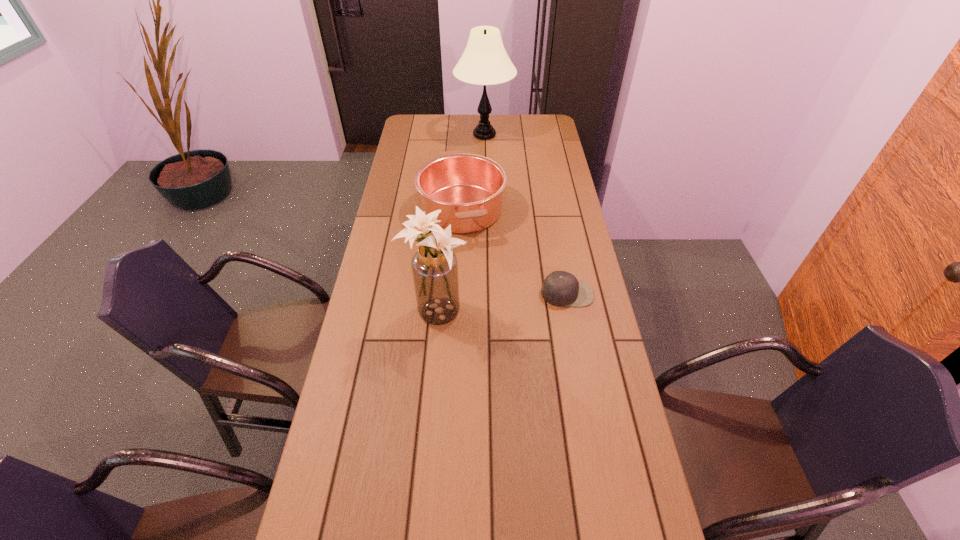
This screenshot has height=540, width=960. Identify the location of lamp. (484, 62).

Identify the location of the farthest object. The image size is (960, 540). (484, 62).

Where is `the second tallest object`? The height and width of the screenshot is (540, 960). the second tallest object is located at coordinates (434, 266).

Image resolution: width=960 pixels, height=540 pixels. Find the location of `saucepan`. saucepan is located at coordinates (468, 189).

You are a GUI agent. You are given a task and a screenshot of the screen. Output one action in this format:
    pyautogui.click(x=<x>, y=<y>)
    Task: Click on the second shortest object
    This screenshot has height=540, width=960.
    Given the screenshot: What is the action you would take?
    pyautogui.click(x=468, y=189)

Locate an element on the screen. The height and width of the screenshot is (540, 960). cap is located at coordinates pos(560,288).

The height and width of the screenshot is (540, 960). What are the coordinates of `the rightmost object` in the screenshot? It's located at (560, 288).

Locate an element on the screen. This screenshot has height=540, width=960. vacant space situated on the left of the lamp is located at coordinates (426, 135).

Where is `vacant space located 0.150m on the back of the flower arrangement`? The width and height of the screenshot is (960, 540). vacant space located 0.150m on the back of the flower arrangement is located at coordinates (441, 260).

Find the location of a particular element. The image size is (960, 540). free space located 0.380m on the front of the third nearest object is located at coordinates (x=456, y=333).